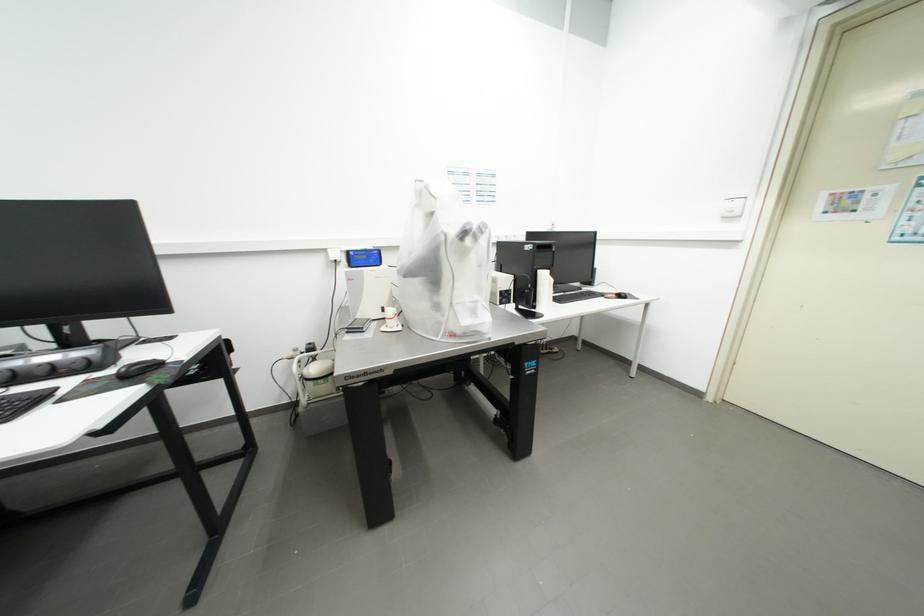
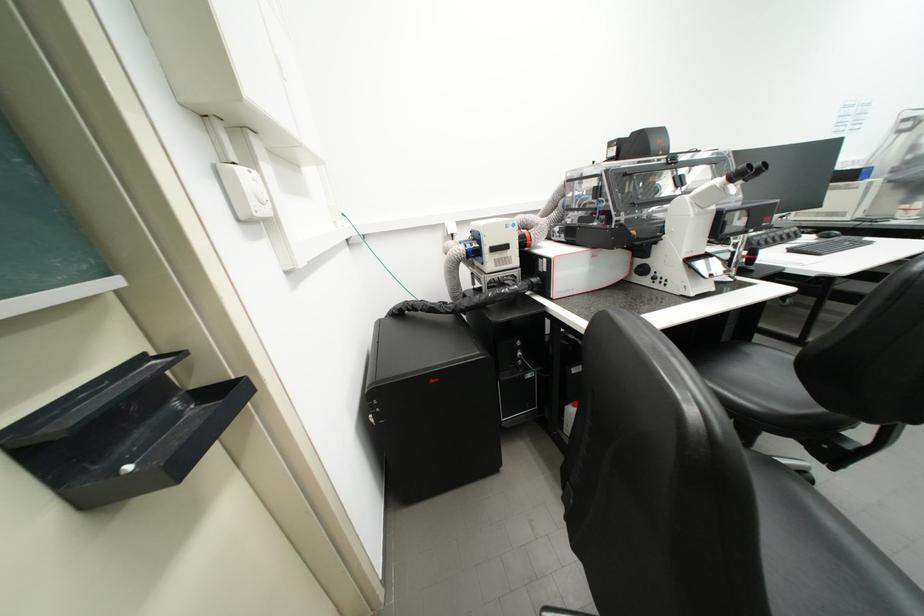
In a continuous first-person perspective shot, in which direction is the camera moving?

The cameraman walked toward left, backward.